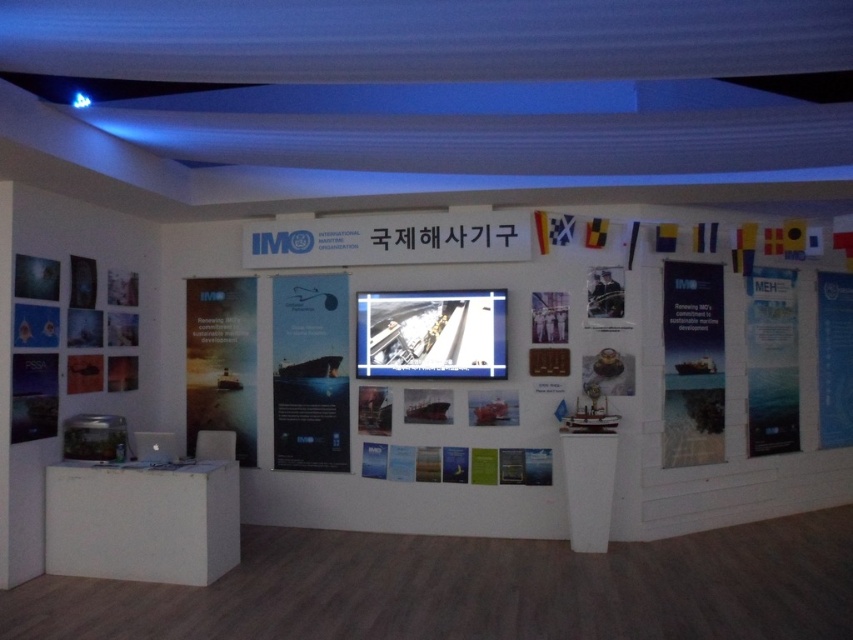
Question: Which object is farther from the camera taking this photo?

Choices:
 (A) blue paper at upper right
 (B) matte orange banner at left

Answer: (A)

Question: Is blue paper poster at right thinner than blue paper at upper right?

Choices:
 (A) no
 (B) yes

Answer: (A)

Question: Where is matte paper poster at center located in relation to matte orange banner at left in the image?

Choices:
 (A) below
 (B) above

Answer: (B)

Question: Which is nearer to the matte orange banner at left?

Choices:
 (A) blue paper at upper right
 (B) blue paper poster at right

Answer: (B)

Question: Which point is farther from the camera taking this photo?

Choices:
 (A) (769, 429)
 (B) (689, 417)

Answer: (A)

Question: Is blue paper poster at center wider than blue paper poster at right?

Choices:
 (A) no
 (B) yes

Answer: (A)